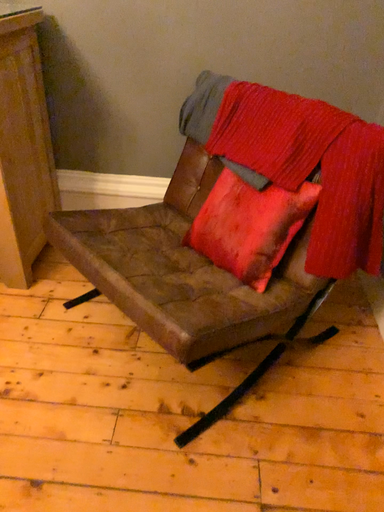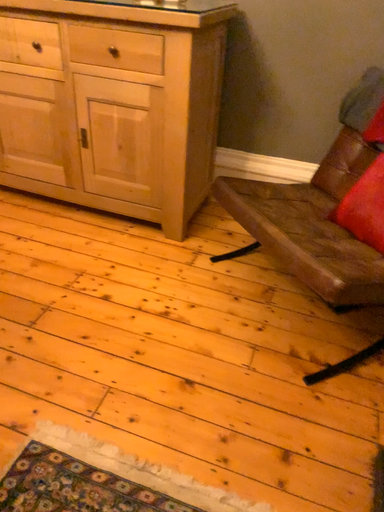
Question: How did the camera likely rotate when shooting the video?

Choices:
 (A) rotated right
 (B) rotated left

Answer: (B)